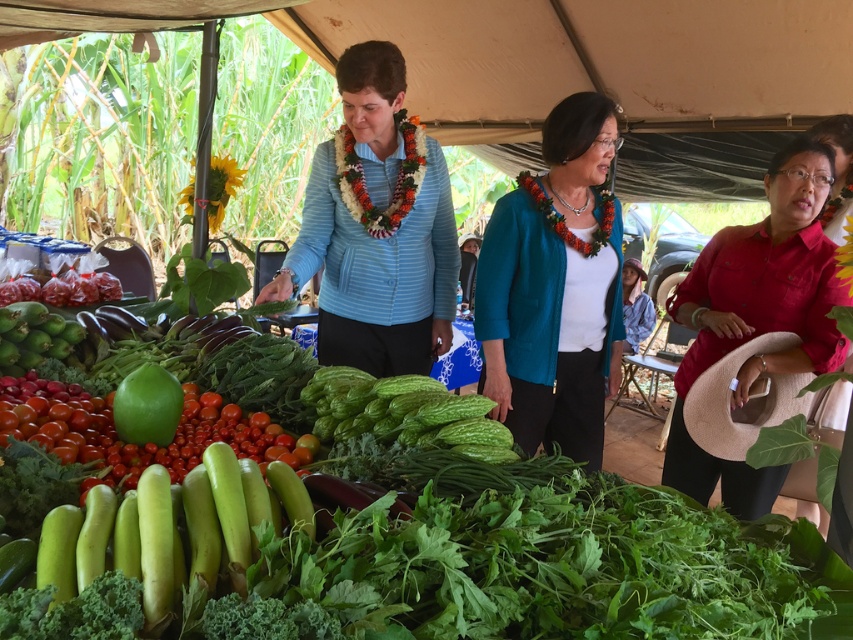
Does red matte shirt at right lie behind green matte melon at center?

Yes.

The height and width of the screenshot is (640, 853). In order to click on red matte shirt at right in this screenshot , I will do `click(758, 316)`.

Is point (619, 328) more distant than point (380, 330)?

No.

Who is higher up, teal fabric jacket at center or blue striped shirt at center?

blue striped shirt at center

Is point (599, 310) closer to camera compared to point (387, 64)?

No, it is behind (387, 64).

Where is `teal fabric jacket at center`? The width and height of the screenshot is (853, 640). teal fabric jacket at center is located at coordinates (555, 289).

Does teal fabric jacket at center appear on the right side of green matte melon at center?

Yes, teal fabric jacket at center is to the right of green matte melon at center.

Which is in front, point (595, 147) or point (144, 412)?

Point (144, 412)

Is point (589, 173) more distant than point (126, 428)?

Yes.

Where is `teal fabric jacket at center`? teal fabric jacket at center is located at coordinates (555, 289).